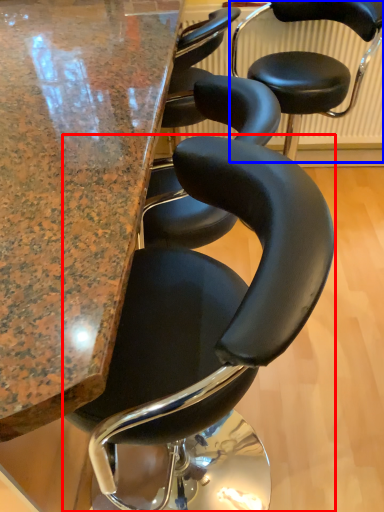
Question: Which point is further to the camera, chair (highlighted by a red box) or chair (highlighted by a blue box)?

Choices:
 (A) chair
 (B) chair

Answer: (B)